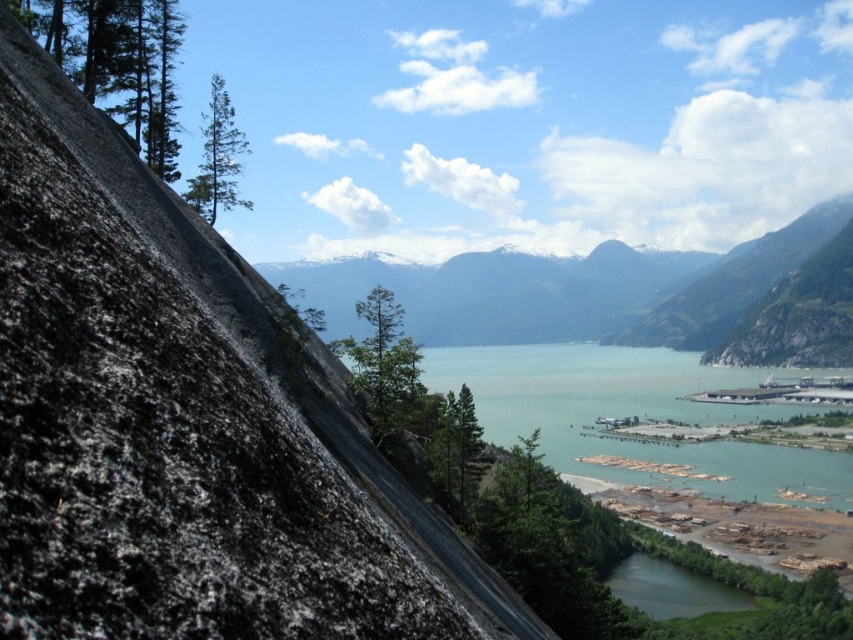
You are a geologist standing at the center of the valley looking towards the rocky outcrop. What are the coordinates of the black granite rock at left?

The coordinates of the black granite rock at left are at point (183, 419).

You are a photographer standing at the base of the snowy granite mountain at upper center. You want to take a photo of the mountain using a camera that has a maximum zoom range of 100 meters. Can you capture the entire mountain in your photo without moving closer?

The snowy granite mountain at upper center and the camera are 627.50 meters apart. Since the camera can only zoom up to 100 meters, it cannot capture the entire mountain without moving closer.